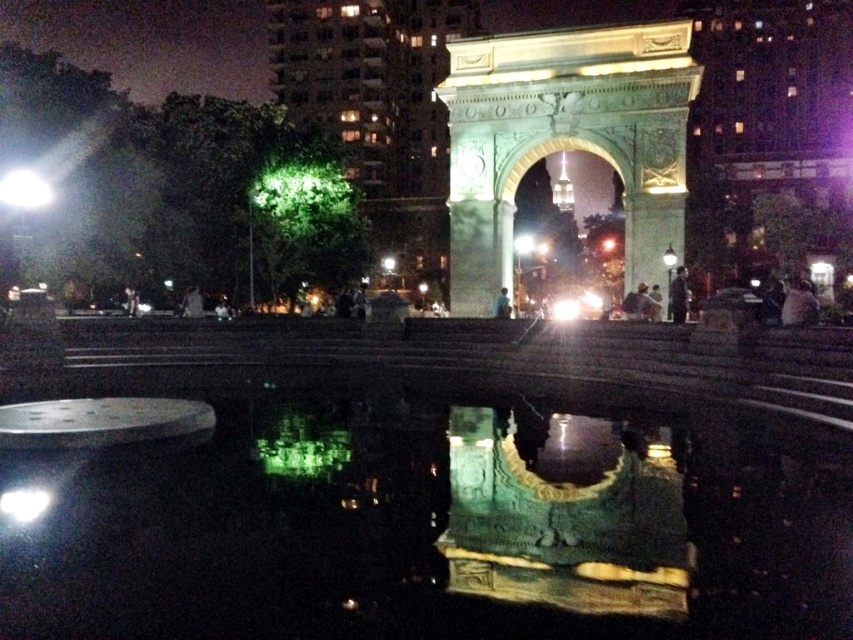
You are an architect analyzing the symmetry of the nighttime scene. You notice the green reflective water at center and the green stone arch at center. Which object takes up more space in the image?

The green stone arch at center takes up more space than the green reflective water at center, as stated in the description that the water occupies less space.

You are standing in front of the stone archway at night. You notice two points marked in the scene. The first point is at coordinate point(131, 497) and the second is at point(618, 212). Which point is closer to you?

Point(131, 497) is closer to the camera than point(618, 212).

You are standing in front of the green stone arch at center and want to see its reflection in the green reflective water at center. In which direction should you look to see the reflection?

You should look to the left to see the reflection of the green stone arch at center in the green reflective water at center, since the green reflective water at center is located to the left of the green stone arch at center.